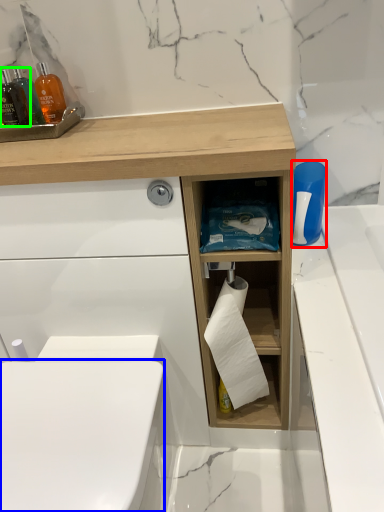
Question: Considering the real-world distances, which object is closest to cleaning product (highlighted by a red box)? toilet bowl (highlighted by a blue box) or mouthwash (highlighted by a green box).

Choices:
 (A) toilet bowl
 (B) mouthwash

Answer: (A)